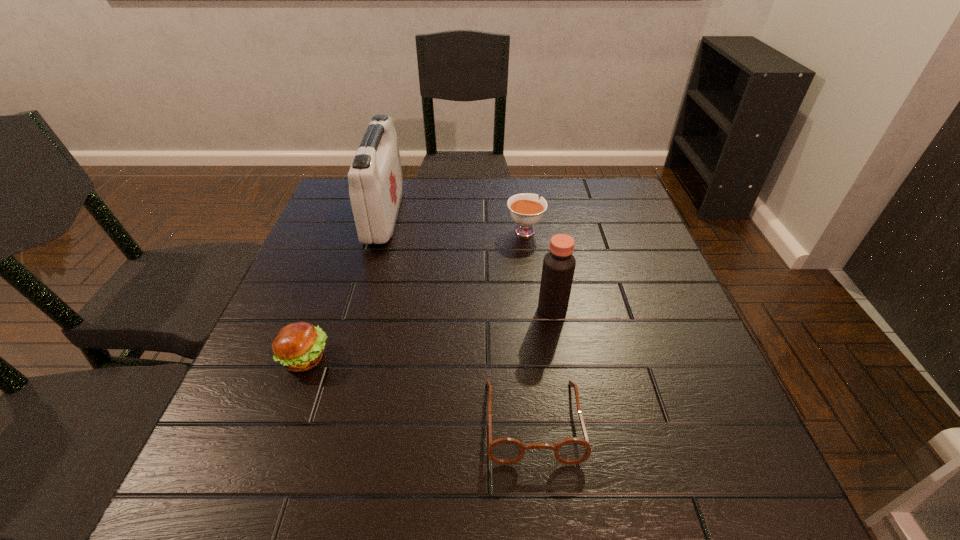
In the image, there is a desktop. In order to click on free region at the near edge in this screenshot , I will do `click(571, 509)`.

Locate an element on the screen. The height and width of the screenshot is (540, 960). vacant point at the left edge is located at coordinates (330, 296).

At what (x,y) coordinates should I click in order to perform the action: click on vacant space at the right edge. Please return your answer as a coordinate pair (x, y). Image resolution: width=960 pixels, height=540 pixels. Looking at the image, I should click on (652, 244).

Locate an element on the screen. vacant space at the far left corner of the desktop is located at coordinates (342, 200).

You are a GUI agent. You are given a task and a screenshot of the screen. Output one action in this format:
    pyautogui.click(x=<x>, y=<y>)
    Task: Click on the free space at the far right corner of the desktop
    
    Given the screenshot: What is the action you would take?
    pyautogui.click(x=579, y=194)

You are a GUI agent. You are given a task and a screenshot of the screen. Output one action in this format:
    pyautogui.click(x=<x>, y=<y>)
    Task: Click on the vacant point located between the first-aid kit and the teacup
    This screenshot has width=960, height=540.
    Given the screenshot: What is the action you would take?
    pyautogui.click(x=455, y=223)

The width and height of the screenshot is (960, 540). I want to click on free space between the second nearest object and the fourth shortest object, so click(429, 334).

You are a GUI agent. You are given a task and a screenshot of the screen. Output one action in this format:
    pyautogui.click(x=<x>, y=<y>)
    Task: Click on the free space between the second nearest object and the teacup
    Image resolution: width=960 pixels, height=540 pixels.
    Given the screenshot: What is the action you would take?
    pyautogui.click(x=415, y=294)

What are the coordinates of `empty space that is in between the first-aid kit and the nearest object` in the screenshot? It's located at (459, 318).

At what (x,y) coordinates should I click in order to perform the action: click on unoccupied position between the fourth shortest object and the second nearest object. Please return your answer as a coordinate pair (x, y). The image size is (960, 540). Looking at the image, I should click on (429, 334).